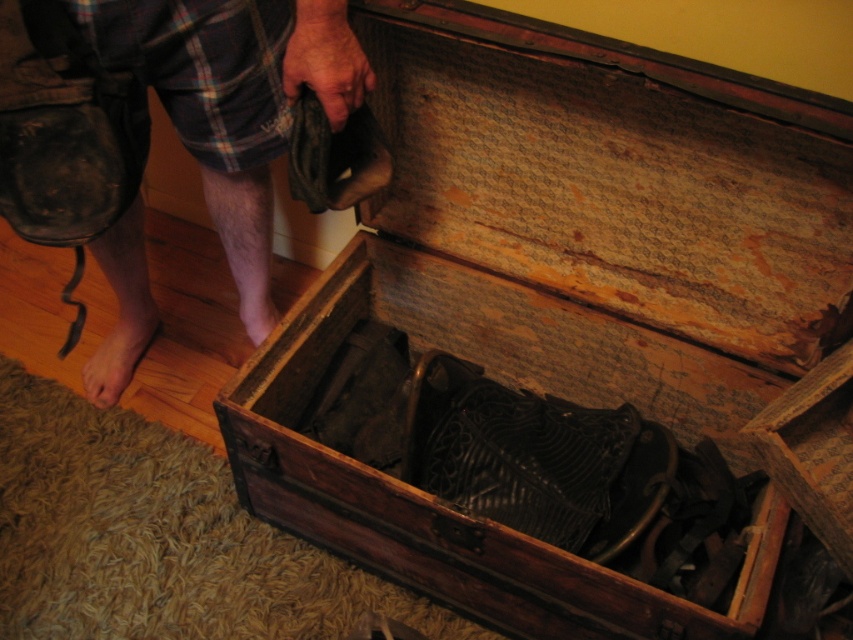
Does wooden trunk at center appear on the left side of pink flesh at lower left?

Incorrect, wooden trunk at center is not on the left side of pink flesh at lower left.

Who is taller, wooden trunk at center or pink flesh at lower left?

wooden trunk at center

Is point (523, 65) positioned in front of point (241, 305)?

Yes, point (523, 65) is in front of point (241, 305).

Locate an element on the screen. wooden trunk at center is located at coordinates (556, 300).

From the picture: How far apart are bare skin at lower left and pink flesh at lower left?

A distance of 9.47 inches exists between bare skin at lower left and pink flesh at lower left.

Looking at this image, between bare skin at lower left and pink flesh at lower left, which one is positioned higher?

pink flesh at lower left

Find the location of a particular element. This screenshot has width=853, height=640. bare skin at lower left is located at coordinates (119, 353).

In the scene shown: Which of these two, wooden trunk at center or bare skin at lower left, stands shorter?

Standing shorter between the two is bare skin at lower left.

Does wooden trunk at center appear over bare skin at lower left?

Correct, wooden trunk at center is located above bare skin at lower left.

Find the location of a particular element. The width and height of the screenshot is (853, 640). wooden trunk at center is located at coordinates (556, 300).